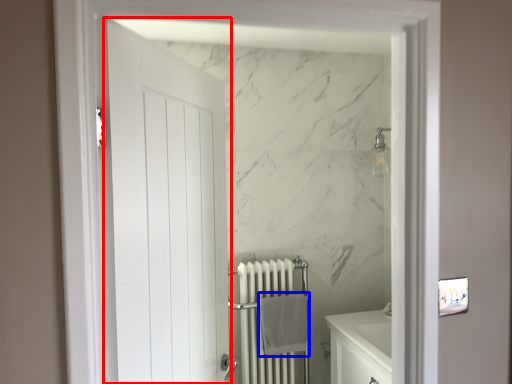
Question: Among these objects, which one is nearest to the camera, door (highlighted by a red box) or bath towel (highlighted by a blue box)?

Choices:
 (A) door
 (B) bath towel

Answer: (A)